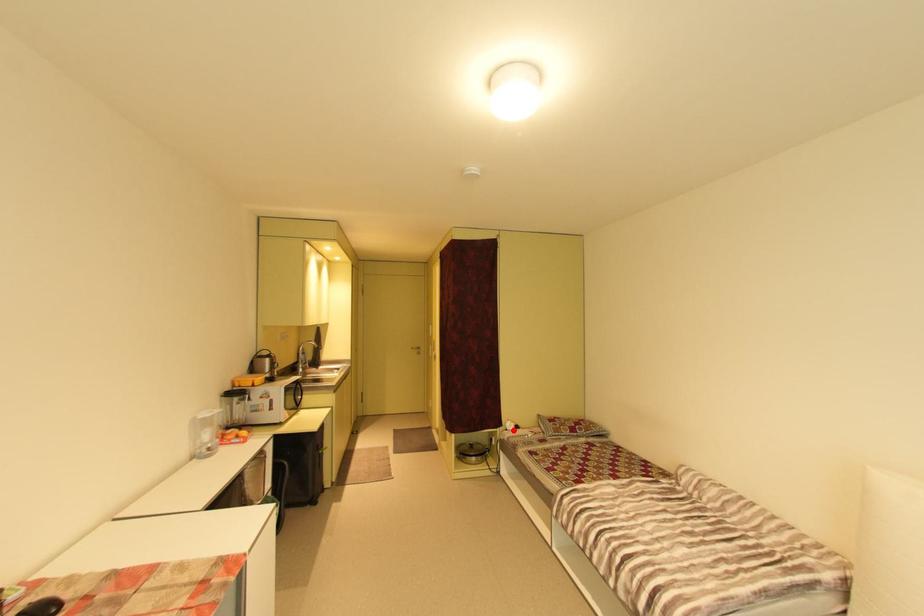
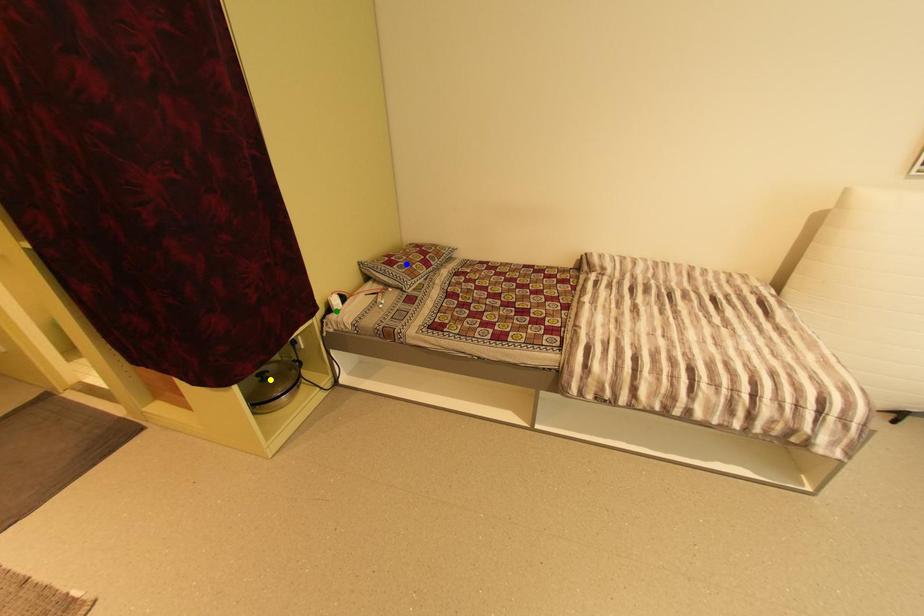
Question: I am providing you with two images of the same scene from different viewpoints. A red point is marked on the first image. You are given multiple points on the second image. Which mark in image 2 goes with the point in image 1?

Choices:
 (A) yellow point
 (B) blue point
 (C) green point

Answer: (C)